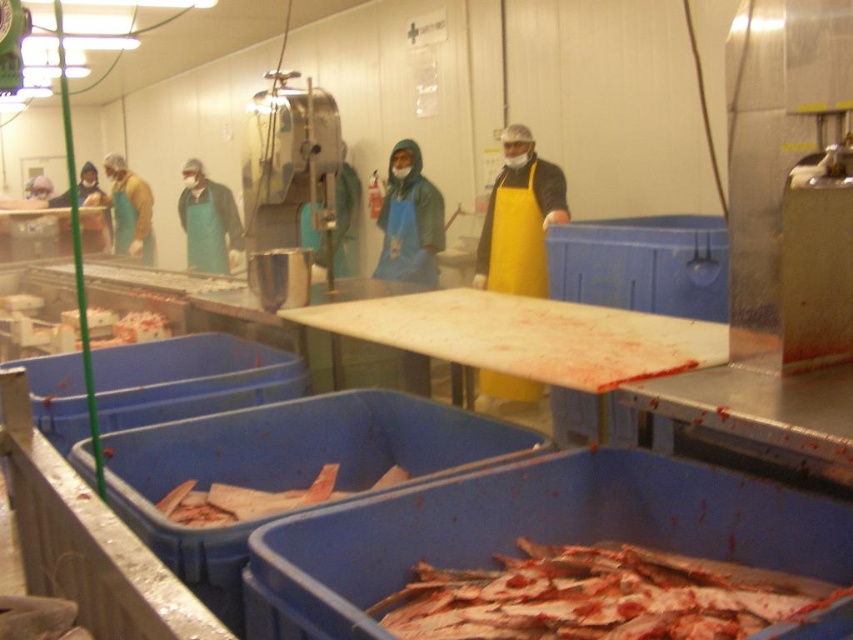
Based on the photo, you are a safety inspector in the fish processing facility. You need to check the condition of the pinkish flesh at lower left located at point [244,500]. What is the position of the pinkish flesh at lower left relative to the blue plastic bins filled with fish fillets or parts?

The pinkish flesh at lower left is located at point [244,500], which is the lower left area of the scene. The blue plastic bins filled with fish fillets or parts are in the foreground, so the pinkish flesh at lower left is positioned below and to the left of the blue plastic bins.

You are a safety inspector with a 1.2 meter long inspection tool. You need to check the shiny silver fish at lower center. Can you reach it from your current position without moving closer?

The shiny silver fish at lower center and camera are 1.16 meters apart from each other. Since your inspection tool is 1.2 meters long, you can reach it without moving closer.

You are a safety inspector checking the equipment in the fish processing facility. You notice two aprons, the blue apron at center and the green apron at center. Which apron has a smaller width?

The blue apron at center has a smaller width than the green apron at center.